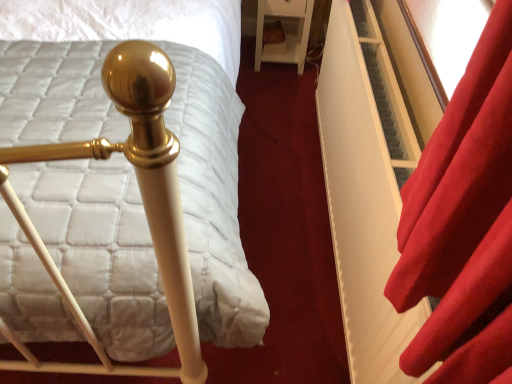
Question: From the image's perspective, is velvet red curtain at right positioned above or below white glossy nightstand at upper right?

Choices:
 (A) below
 (B) above

Answer: (A)

Question: Considering the positions of velvet red curtain at right and white glossy nightstand at upper right in the image, is velvet red curtain at right bigger or smaller than white glossy nightstand at upper right?

Choices:
 (A) big
 (B) small

Answer: (B)

Question: Estimate the real-world distances between objects in this image. Which object is closer to the white glossy nightstand at upper right?

Choices:
 (A) white matte bed frame at center
 (B) white quilted mattress at center
 (C) velvet red curtain at right

Answer: (A)

Question: Estimate the real-world distances between objects in this image. Which object is farther from the white quilted mattress at center?

Choices:
 (A) white glossy nightstand at upper right
 (B) velvet red curtain at right
 (C) white matte bed frame at center

Answer: (A)